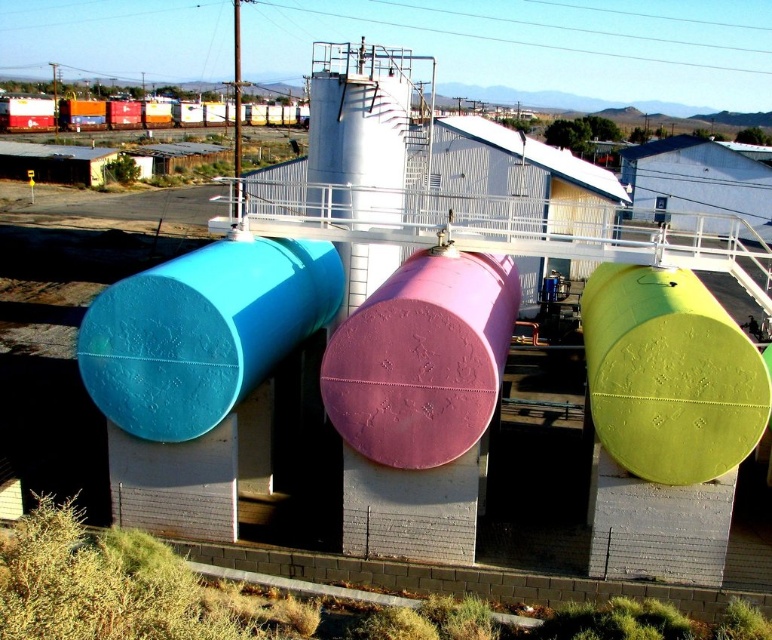
Question: Which object is the closest to the matte blue barrel at center left?

Choices:
 (A) green matte tank at center
 (B) pink matte tank at center

Answer: (B)

Question: Does matte blue barrel at center left have a greater width compared to green matte tank at center?

Choices:
 (A) yes
 (B) no

Answer: (A)

Question: Can you confirm if matte blue barrel at center left is bigger than green matte tank at center?

Choices:
 (A) no
 (B) yes

Answer: (B)

Question: Which point is farther from the camera taking this photo?

Choices:
 (A) (759, 387)
 (B) (107, 308)
 (C) (445, 259)

Answer: (C)

Question: Which of the following is the farthest from the observer?

Choices:
 (A) matte blue barrel at center left
 (B) pink matte tank at center

Answer: (A)

Question: Can you confirm if green matte tank at center is positioned below pink matte tank at center?

Choices:
 (A) no
 (B) yes

Answer: (A)